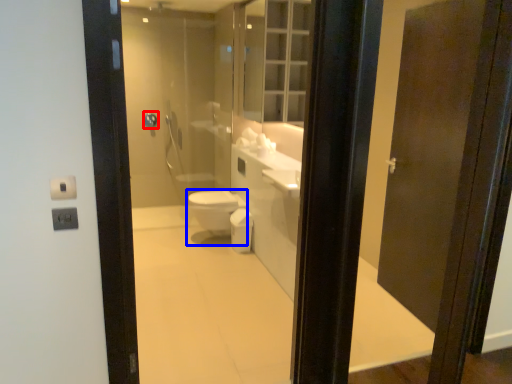
Question: Which object appears farthest to the camera in this image, towel bar (highlighted by a red box) or bidet (highlighted by a blue box)?

Choices:
 (A) towel bar
 (B) bidet

Answer: (A)